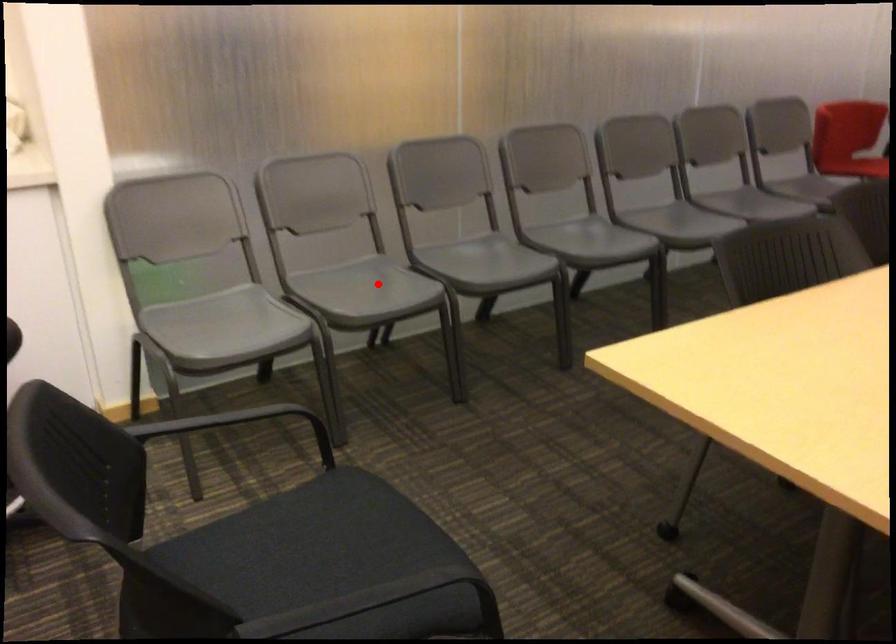
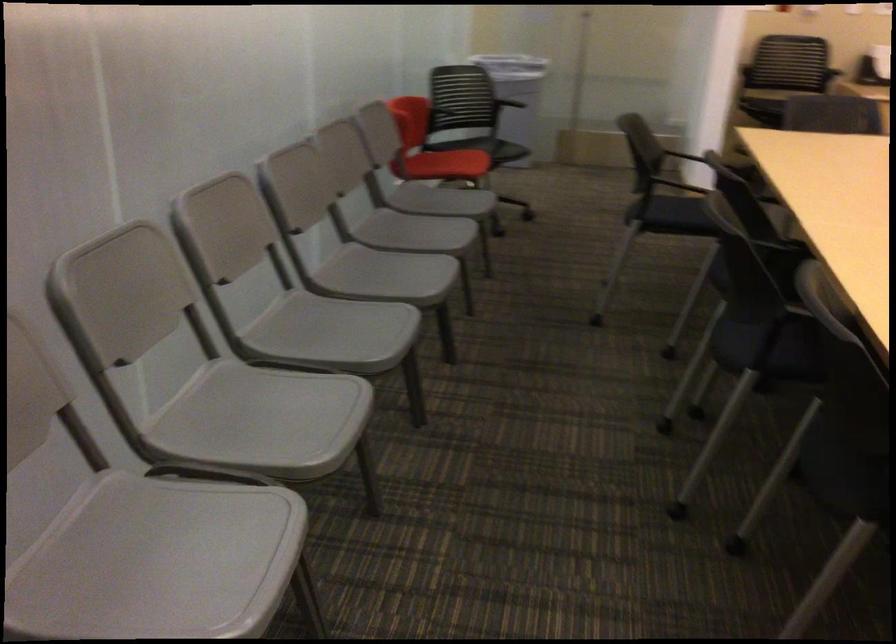
Where in the second image is the point corresponding to the highlighted location from the first image?

(158, 561)